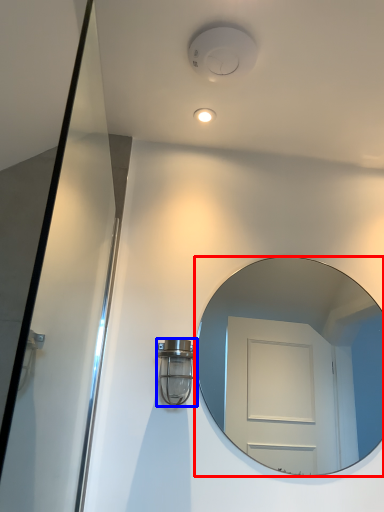
Question: Which object appears farthest to the camera in this image, mirror (highlighted by a red box) or light fixture (highlighted by a blue box)?

Choices:
 (A) mirror
 (B) light fixture

Answer: (A)